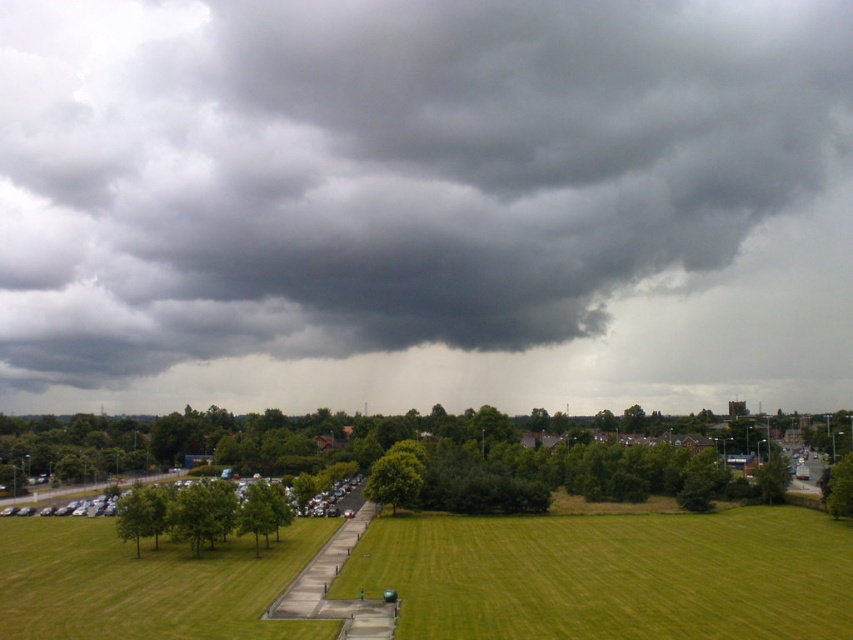
Does dark gray cloud at upper center have a larger size compared to green grassy field at center?

Correct, dark gray cloud at upper center is larger in size than green grassy field at center.

Does dark gray cloud at upper center lie in front of green grassy field at center?

No, dark gray cloud at upper center is behind green grassy field at center.

This screenshot has height=640, width=853. What do you see at coordinates (415, 177) in the screenshot?
I see `dark gray cloud at upper center` at bounding box center [415, 177].

At what (x,y) coordinates should I click in order to perform the action: click on dark gray cloud at upper center. Please return your answer as a coordinate pair (x, y). The image size is (853, 640). Looking at the image, I should click on (415, 177).

Which is in front, point (575, 554) or point (0, 557)?

Point (0, 557)

Which of these two, green grassy field at center or green grass at lower left, stands shorter?

With less height is green grassy field at center.

Does point (526, 547) lie behind point (131, 604)?

Yes, it is.

You are a GUI agent. You are given a task and a screenshot of the screen. Output one action in this format:
    pyautogui.click(x=<x>, y=<y>)
    Task: Click on the green grassy field at center
    
    Given the screenshot: What is the action you would take?
    pyautogui.click(x=611, y=576)

Find the location of a particular element. The height and width of the screenshot is (640, 853). dark gray cloud at upper center is located at coordinates point(415,177).

The height and width of the screenshot is (640, 853). Describe the element at coordinates (415, 177) in the screenshot. I see `dark gray cloud at upper center` at that location.

Where is `dark gray cloud at upper center`? dark gray cloud at upper center is located at coordinates (415, 177).